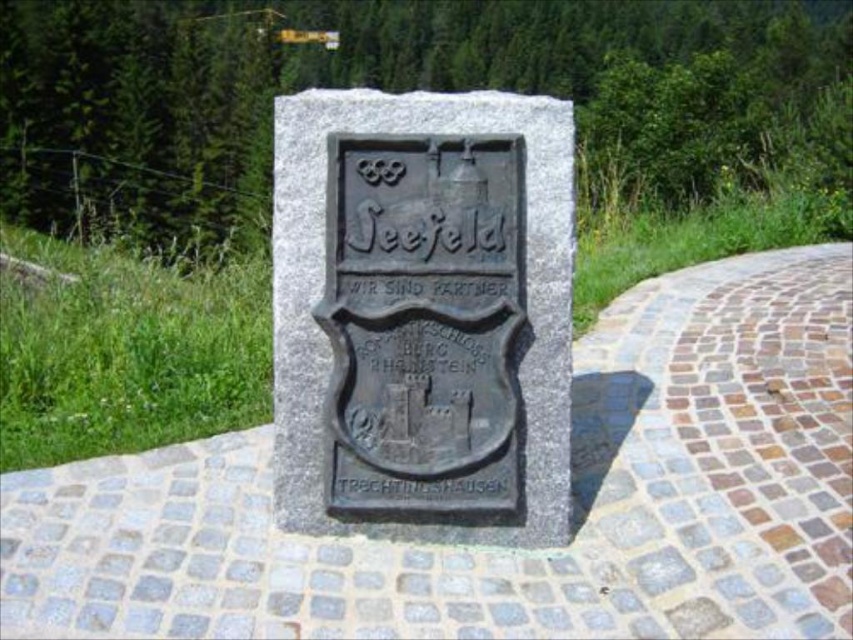
Describe the element at coordinates (512, 548) in the screenshot. I see `gray stone path at center` at that location.

Is point (337, 566) positioned before point (277, 288)?

Yes, point (337, 566) is in front of point (277, 288).

The height and width of the screenshot is (640, 853). What do you see at coordinates (512, 548) in the screenshot?
I see `gray stone path at center` at bounding box center [512, 548].

Where is `gray stone path at center`? gray stone path at center is located at coordinates (512, 548).

Can you confirm if bronze plaque at center is shorter than black stone sign at center?

In fact, bronze plaque at center may be taller than black stone sign at center.

Who is positioned more to the right, bronze plaque at center or black stone sign at center?

black stone sign at center is more to the right.

Which is behind, point (341, 326) or point (482, 474)?

Positioned behind is point (482, 474).

You are a GUI agent. You are given a task and a screenshot of the screen. Output one action in this format:
    pyautogui.click(x=<x>, y=<y>)
    Task: Click on the bronze plaque at center
    The height and width of the screenshot is (640, 853).
    Given the screenshot: What is the action you would take?
    pyautogui.click(x=422, y=307)

Can you confirm if gray stone path at center is wider than black stone sign at center?

Yes.

From the picture: Does gray stone path at center lie behind black stone sign at center?

No, gray stone path at center is closer to the viewer.

Image resolution: width=853 pixels, height=640 pixels. What are the coordinates of `gray stone path at center` in the screenshot? It's located at (512, 548).